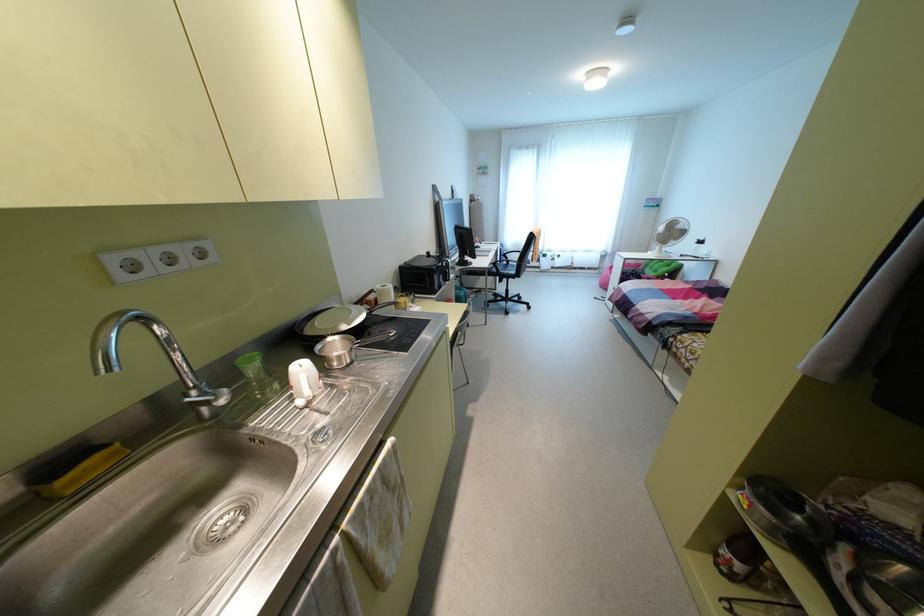
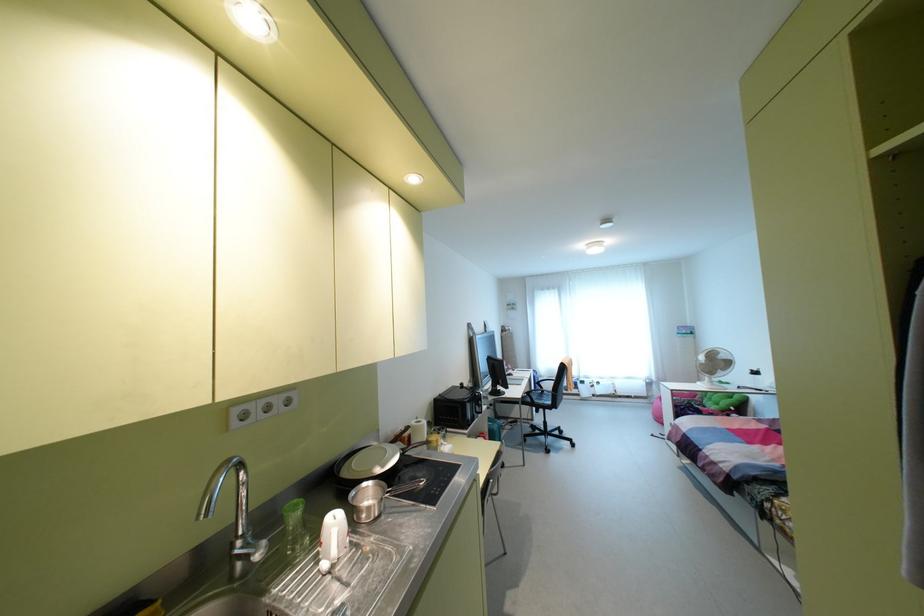
Question: How did the camera likely rotate?

Choices:
 (A) Left
 (B) Right
 (C) Up
 (D) Down

Answer: (C)